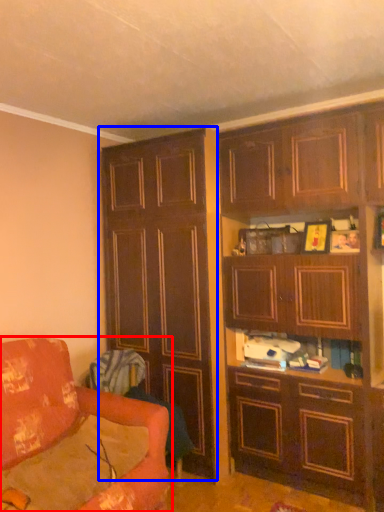
Question: Which point is closer to the camera, studio couch (highlighted by a red box) or cabinetry (highlighted by a blue box)?

Choices:
 (A) studio couch
 (B) cabinetry

Answer: (A)